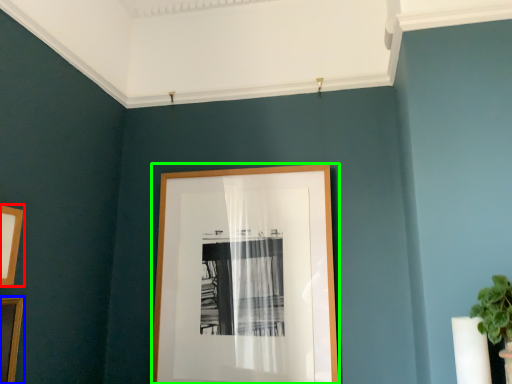
Question: Which is nearer to the picture frame (highlighted by a red box)? picture frame (highlighted by a blue box) or picture frame (highlighted by a green box).

Choices:
 (A) picture frame
 (B) picture frame

Answer: (A)